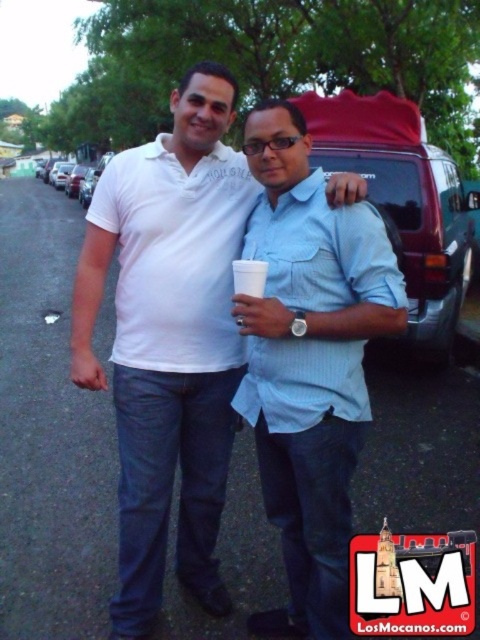
You are a photographer setting up a photo shoot in the described scene. You need to position a backdrop that is 1.8 meters tall. Considering the height of the white cotton polo shirt at center and the light blue cotton shirt at center, which person should stand closer to the top of the backdrop to ensure their head doesn

The white cotton polo shirt at center is taller than the light blue cotton shirt at center. Therefore, the person wearing the white cotton polo shirt at center should stand closer to the top of the backdrop to accommodate their greater height.

You are a photographer trying to capture a portrait of both individuals wearing white cotton polo shirt at center and light blue cotton shirt at center. Since the camera can only focus on one subject at a time, which person should you focus on first to ensure their face is in focus while the other is slightly blurred?

The white cotton polo shirt at center is below the light blue cotton shirt at center, so you should focus on the light blue cotton shirt at center first since it is higher up, allowing the lower subject to be slightly blurred while keeping the focused subject sharp.